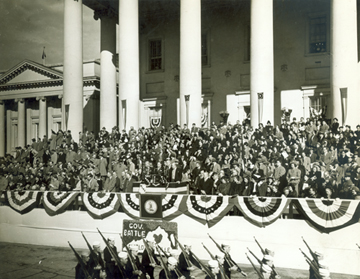
The image size is (360, 279). What are the coordinates of `wall` in the screenshot? It's located at (73, 221).